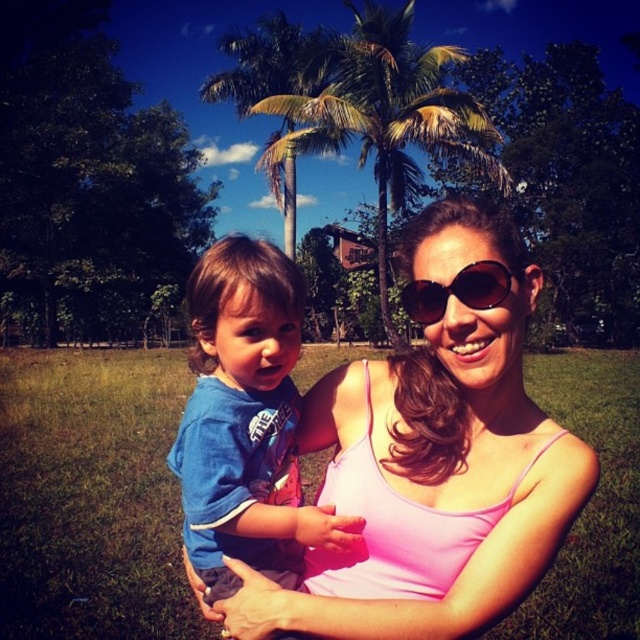
Question: Which object is the closest to the green grass at center?

Choices:
 (A) blue cotton shirt at center
 (B) green leafy palm tree at center
 (C) sunglasses at center

Answer: (A)

Question: Among these objects, which one is nearest to the camera?

Choices:
 (A) green leafy palm tree at center
 (B) blue cotton shirt at center
 (C) green grass at center
 (D) sunglasses at center

Answer: (D)

Question: Does blue cotton shirt at center have a larger size compared to green leafy palm tree at center?

Choices:
 (A) yes
 (B) no

Answer: (B)

Question: Which object is farther from the camera taking this photo?

Choices:
 (A) sunglasses at center
 (B) green leafy palm tree at center
 (C) blue cotton shirt at center
 (D) green grass at center

Answer: (B)

Question: Can you confirm if green grass at center is positioned above blue cotton shirt at center?

Choices:
 (A) yes
 (B) no

Answer: (B)

Question: From the image, what is the correct spatial relationship of blue cotton shirt at center in relation to sunglasses at center?

Choices:
 (A) left
 (B) right

Answer: (A)